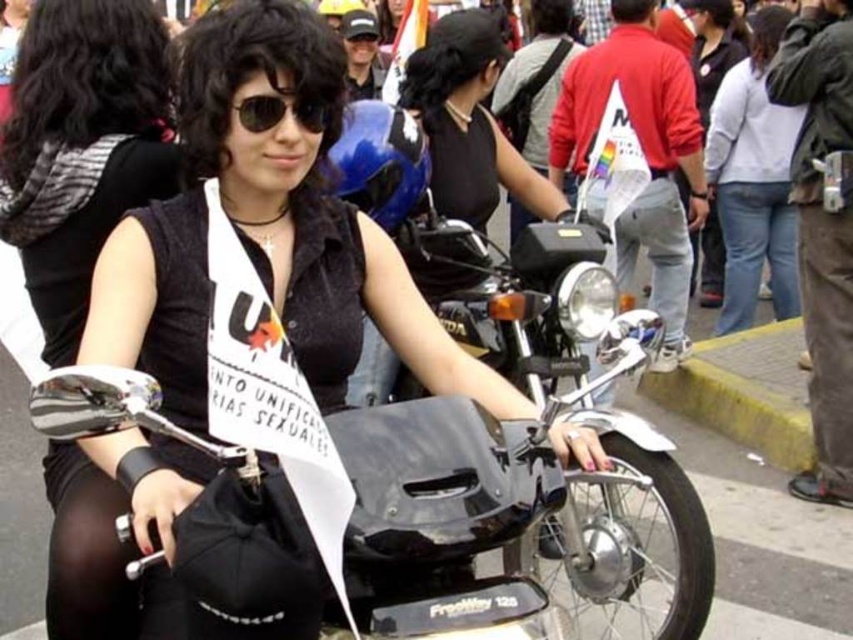
You are a photographer trying to capture a clear shot of both the black matte helmet at upper center and the matte black sunglasses at center. Which object should you focus on first to ensure it appears larger in the photo?

The black matte helmet at upper center is much taller than the matte black sunglasses at center, so focusing on it first will ensure it appears larger in the photo.

What are the coordinates of the black matte helmet at upper center?

The black matte helmet at upper center is located at point (469, 122).